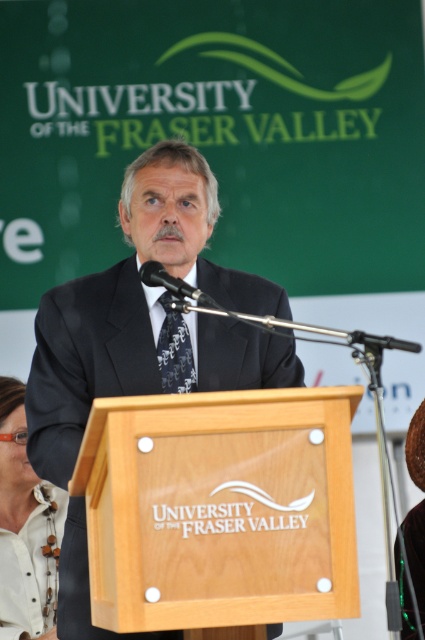
You are a photographer standing at the back of the room. You want to take a photo of the speaker while ensuring both the white leather necklace at lower left and the patterned silk tie at center are clearly visible. Given that your camera has a minimum focus distance of 1.5 meters, will you be able to capture both items in focus at the same time?

The white leather necklace at lower left and the patterned silk tie at center are 1.61 meters apart. Since the distance between them is greater than the camera minimum focus distance of 1.5 meters, the camera can focus on both items simultaneously.

You are an event photographer at the University of the Fraser Valley. You need to capture a closeup shot of the speaker while ensuring both the dark suit at center and the patterned silk tie at center are visible. Based on their positions, which side of the speaker should you focus on to include both elements in the frame?

The dark suit at center is to the left of the patterned silk tie at center, so focusing on the left side of the speaker will ensure both the dark suit at center and the patterned silk tie at center are visible in the frame.